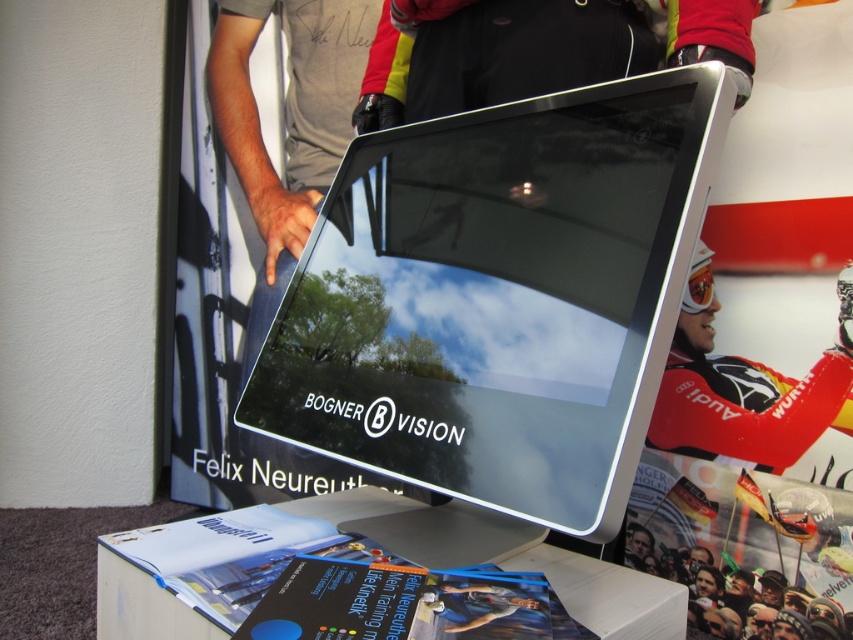
Question: Which object appears closest to the camera in this image?

Choices:
 (A) white plastic table at lower center
 (B) red matte skier at center

Answer: (A)

Question: Among these points, which one is nearest to the camera?

Choices:
 (A) (567, 410)
 (B) (769, 390)
 (C) (410, 515)

Answer: (A)

Question: Does white plastic table at lower center have a greater width compared to red matte skier at center?

Choices:
 (A) no
 (B) yes

Answer: (B)

Question: Among these points, which one is farthest from the camera?

Choices:
 (A) (675, 250)
 (B) (318, 500)
 (C) (709, 330)

Answer: (C)

Question: Does sleek silver monitor at center lie behind white plastic table at lower center?

Choices:
 (A) no
 (B) yes

Answer: (B)

Question: Does sleek silver monitor at center appear over white plastic table at lower center?

Choices:
 (A) no
 (B) yes

Answer: (B)